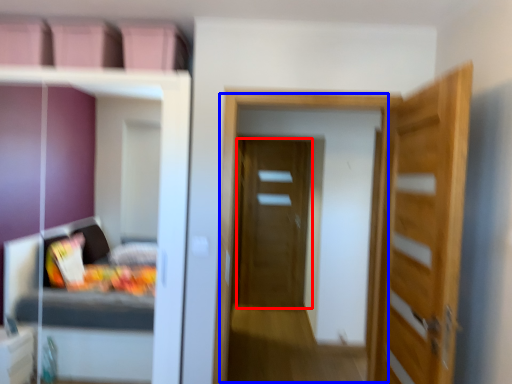
Question: Which object appears farthest to the camera in this image, door (highlighted by a red box) or screen door (highlighted by a blue box)?

Choices:
 (A) door
 (B) screen door

Answer: (A)